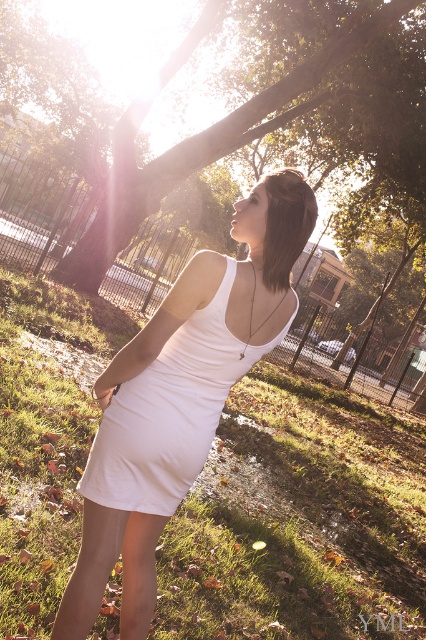
Question: Is white matte dress at center smaller than green leafy tree at upper center?

Choices:
 (A) yes
 (B) no

Answer: (A)

Question: Which point is farther from the camera taking this photo?

Choices:
 (A) (120, 433)
 (B) (103, 259)
 (C) (186, 346)

Answer: (B)

Question: Which of the following is the farthest from the observer?

Choices:
 (A) white matte dress at center
 (B) green leafy tree at upper center

Answer: (B)

Question: Is white matte dress at center below white fabric dress at center?

Choices:
 (A) yes
 (B) no

Answer: (A)

Question: Can you confirm if white fabric dress at center is positioned below green leafy tree at upper center?

Choices:
 (A) yes
 (B) no

Answer: (A)

Question: Among these objects, which one is nearest to the camera?

Choices:
 (A) white matte dress at center
 (B) green leafy tree at upper center

Answer: (A)